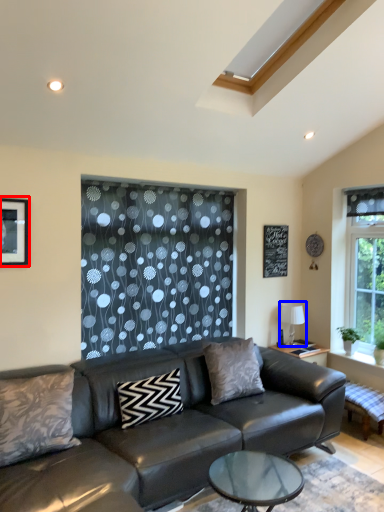
Question: Which object appears closest to the camera in this image, picture frame (highlighted by a red box) or lamp (highlighted by a blue box)?

Choices:
 (A) picture frame
 (B) lamp

Answer: (A)